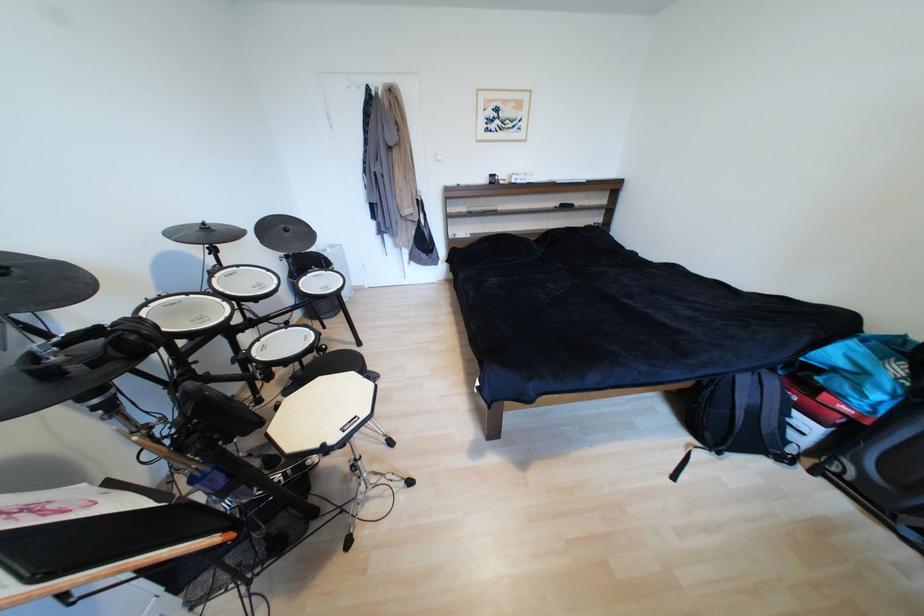
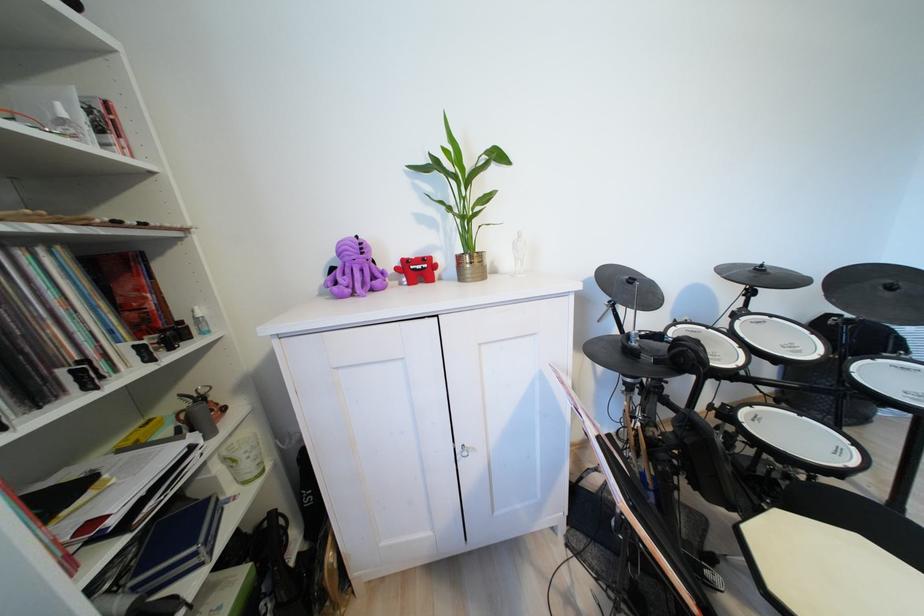
Find the pixel in the second image that matches (139,338) in the first image.

(699, 357)